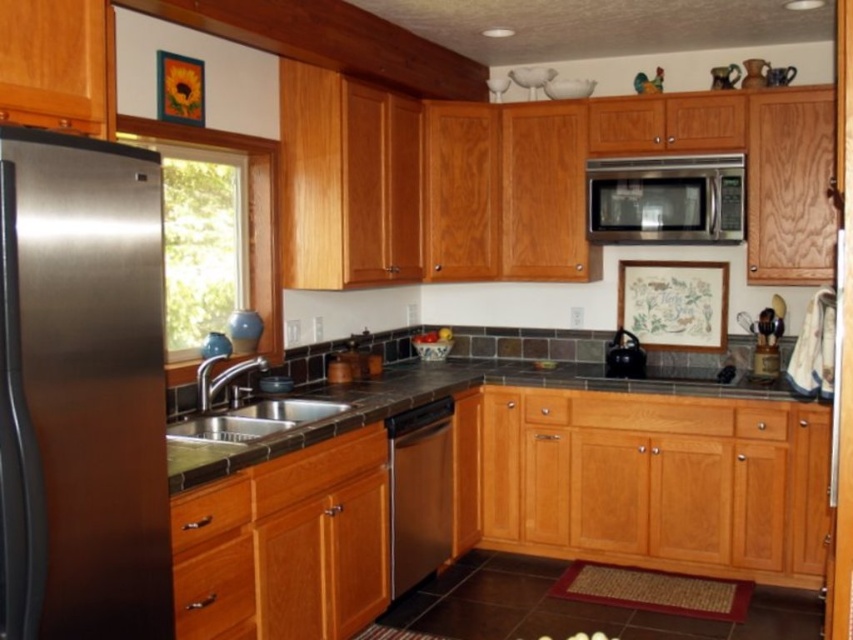
Can you confirm if stainless steel refrigerator at left is bigger than dark gray granite countertop at center?

Incorrect, stainless steel refrigerator at left is not larger than dark gray granite countertop at center.

Who is positioned more to the right, stainless steel refrigerator at left or dark gray granite countertop at center?

Positioned to the right is dark gray granite countertop at center.

Locate an element on the screen. stainless steel refrigerator at left is located at coordinates click(80, 390).

Is point (79, 413) positioned after point (743, 202)?

No, it is in front of (743, 202).

Which is behind, point (62, 144) or point (728, 208)?

The point (728, 208) is more distant.

Image resolution: width=853 pixels, height=640 pixels. Identify the location of stainless steel refrigerator at left. [x=80, y=390].

Who is positioned more to the right, satin silver microwave at upper center or stainless steel dishwasher at center?

From the viewer's perspective, satin silver microwave at upper center appears more on the right side.

Between point (676, 227) and point (413, 550), which one is positioned in front?

Positioned in front is point (413, 550).

You are a GUI agent. You are given a task and a screenshot of the screen. Output one action in this format:
    pyautogui.click(x=<x>, y=<y>)
    Task: Click on the satin silver microwave at upper center
    The height and width of the screenshot is (640, 853).
    Given the screenshot: What is the action you would take?
    pyautogui.click(x=666, y=198)